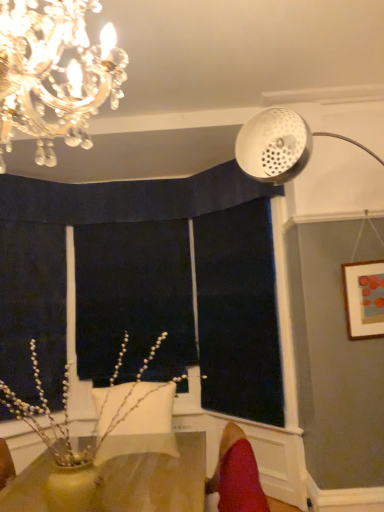
Question: From the image's perspective, is matte white picture frame at upper right located above or below white pearlized branches at lower left?

Choices:
 (A) below
 (B) above

Answer: (B)

Question: From a real-world perspective, relative to white pearlized branches at lower left, is matte white picture frame at upper right vertically above or below?

Choices:
 (A) below
 (B) above

Answer: (B)

Question: Considering the real-world distances, which object is closest to the black fabric at center, the second window screen in the right-to-left sequence?

Choices:
 (A) red velvet swivel chair at lower right
 (B) matte yellow vase at lower center
 (C) dark blue fabric at center, which is counted as the 2th window screen, starting from the left
 (D) white pearlized branches at lower left
 (E) crystal chandelier at upper left

Answer: (C)

Question: Estimate the real-world distances between objects in this image. Which object is farther from the dark blue fabric at center, which ranks as the first window screen in right-to-left order?

Choices:
 (A) black fabric at center, the second window screen in the right-to-left sequence
 (B) white pearlized branches at lower left
 (C) red velvet swivel chair at lower right
 (D) matte yellow vase at lower center
 (E) crystal chandelier at upper left

Answer: (E)